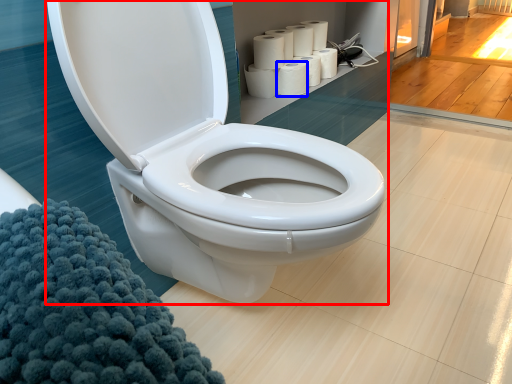
Question: Among these objects, which one is farthest to the camera, toilet (highlighted by a red box) or paper towel (highlighted by a blue box)?

Choices:
 (A) toilet
 (B) paper towel

Answer: (B)